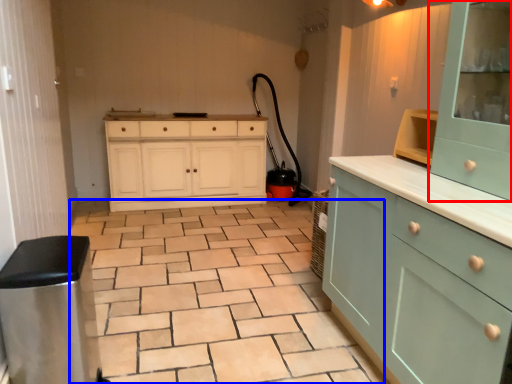
Question: Which of the following is the closest to the observer, cabinetry (highlighted by a red box) or ceramic tile (highlighted by a blue box)?

Choices:
 (A) cabinetry
 (B) ceramic tile

Answer: (A)